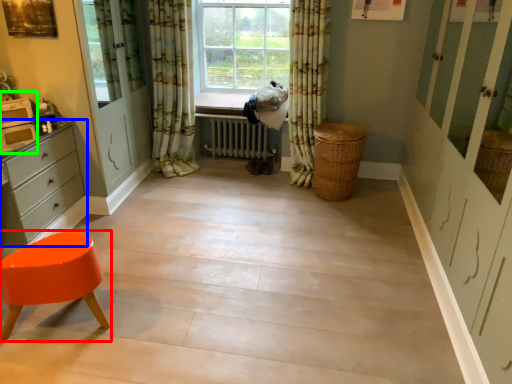
Question: Which object is the farthest from stool (highlighted by a red box)? Choose among these: chest of drawers (highlighted by a blue box) or appliance (highlighted by a green box).

Choices:
 (A) chest of drawers
 (B) appliance

Answer: (B)